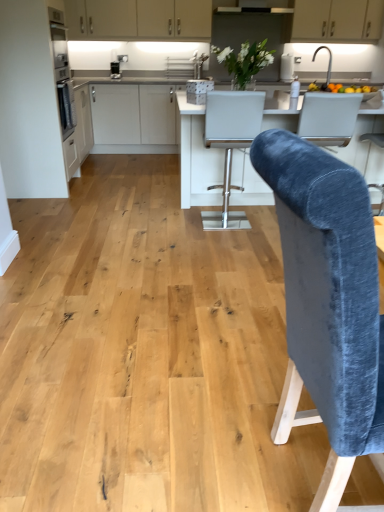
Question: Should I look upward or downward to see matte white cabinets at upper center, the 2th cabinetry positioned from the back?

Choices:
 (A) down
 (B) up

Answer: (B)

Question: Is matte white cabinets at upper center, placed as the 2th cabinetry when sorted from front to back, wider than white leather bar stool at center, the first chair positioned from the back?

Choices:
 (A) no
 (B) yes

Answer: (A)

Question: Is matte white cabinets at upper center, the 2th cabinetry viewed from the top, beside white leather bar stool at center, which ranks as the first chair in top-to-bottom order?

Choices:
 (A) no
 (B) yes

Answer: (A)

Question: Is matte white cabinets at upper center, the 2th cabinetry positioned from the back, not close to white leather bar stool at center, which is the second chair from front to back?

Choices:
 (A) no
 (B) yes

Answer: (B)

Question: Would you say matte white cabinets at upper center, arranged as the 2th cabinetry when viewed from the left, is outside white leather bar stool at center, which is the second chair from front to back?

Choices:
 (A) yes
 (B) no

Answer: (A)

Question: From a real-world perspective, is matte white cabinets at upper center, placed as the 2th cabinetry when sorted from front to back, below white leather bar stool at center, the 2th chair when ordered from bottom to top?

Choices:
 (A) no
 (B) yes

Answer: (A)

Question: Is the position of matte white cabinets at upper center, the 2th cabinetry viewed from the top, less distant than that of white leather bar stool at center, which is the second chair from front to back?

Choices:
 (A) yes
 (B) no

Answer: (B)

Question: Considering the relative positions of velvet blue armchair at right and matte white cabinets at upper center, placed as the 2th cabinetry when sorted from front to back, in the image provided, is velvet blue armchair at right to the left of matte white cabinets at upper center, placed as the 2th cabinetry when sorted from front to back, from the viewer's perspective?

Choices:
 (A) no
 (B) yes

Answer: (A)

Question: Would you say velvet blue armchair at right contains matte white cabinets at upper center, marked as the 2th cabinetry in a right-to-left arrangement?

Choices:
 (A) no
 (B) yes

Answer: (A)

Question: Is velvet blue armchair at right taller than matte white cabinets at upper center, arranged as the 2th cabinetry when viewed from the left?

Choices:
 (A) no
 (B) yes

Answer: (A)

Question: Is velvet blue armchair at right wider than matte white cabinets at upper center, which appears as the 2th cabinetry when ordered from the bottom?

Choices:
 (A) no
 (B) yes

Answer: (B)

Question: Does velvet blue armchair at right have a smaller size compared to matte white cabinets at upper center, which appears as the 2th cabinetry when ordered from the bottom?

Choices:
 (A) no
 (B) yes

Answer: (B)

Question: Is velvet blue armchair at right at the right side of matte white cabinets at upper center, which appears as the 2th cabinetry when ordered from the bottom?

Choices:
 (A) yes
 (B) no

Answer: (A)

Question: Can you confirm if satin black coffee machine at upper left is bigger than matte white cabinets at upper center, marked as the 2th cabinetry in a right-to-left arrangement?

Choices:
 (A) no
 (B) yes

Answer: (A)